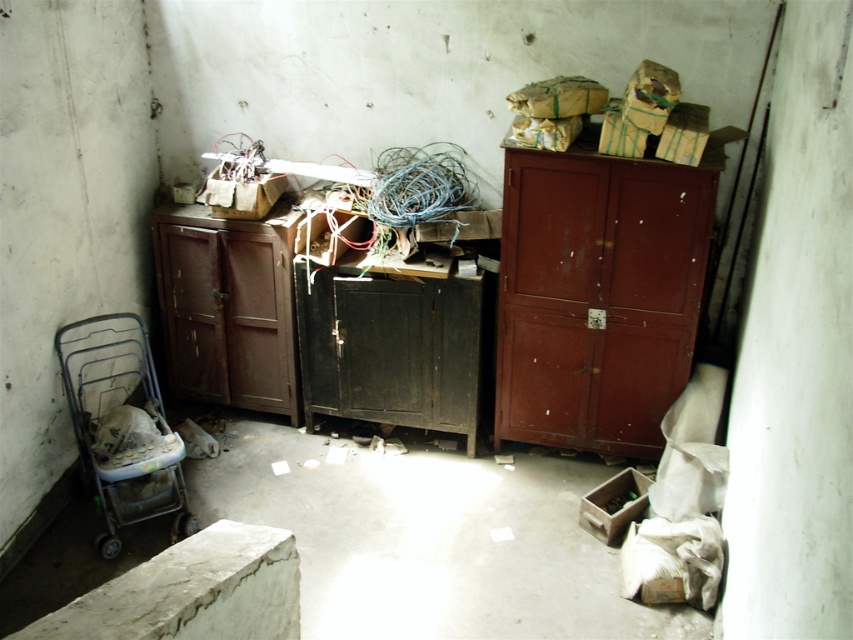
Does matte brown cabinet at center have a greater height compared to metallic wireframe stroller at lower left?

Yes, matte brown cabinet at center is taller than metallic wireframe stroller at lower left.

Is matte brown cabinet at center in front of metallic wireframe stroller at lower left?

No, matte brown cabinet at center is further to the viewer.

Does point (234, 353) come behind point (80, 428)?

That is True.

Identify the location of matte brown cabinet at center. This screenshot has width=853, height=640. (227, 308).

Can you confirm if matte wood cabinet at right is positioned to the right of metallic wireframe stroller at lower left?

Indeed, matte wood cabinet at right is positioned on the right side of metallic wireframe stroller at lower left.

Image resolution: width=853 pixels, height=640 pixels. In order to click on matte wood cabinet at right in this screenshot , I will do `click(596, 296)`.

The width and height of the screenshot is (853, 640). Describe the element at coordinates (596, 296) in the screenshot. I see `matte wood cabinet at right` at that location.

Does point (552, 196) lie behind point (173, 220)?

No, it is in front of (173, 220).

The width and height of the screenshot is (853, 640). What do you see at coordinates (596, 296) in the screenshot?
I see `matte wood cabinet at right` at bounding box center [596, 296].

Image resolution: width=853 pixels, height=640 pixels. What are the coordinates of `matte wood cabinet at right` in the screenshot? It's located at (596, 296).